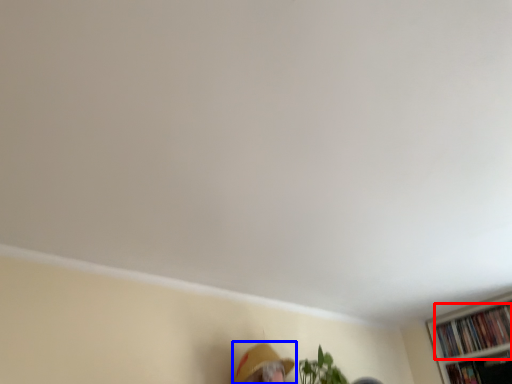
Question: Among these objects, which one is nearest to the camera, book (highlighted by a red box) or person (highlighted by a blue box)?

Choices:
 (A) book
 (B) person

Answer: (B)